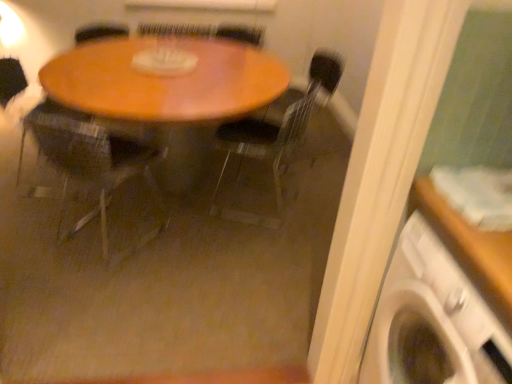
Question: Can you confirm if wooden armchair at center is bigger than wooden table at center?

Choices:
 (A) no
 (B) yes

Answer: (A)

Question: Could you tell me if wooden armchair at center is facing wooden table at center?

Choices:
 (A) yes
 (B) no

Answer: (A)

Question: From the image's perspective, would you say wooden armchair at center is positioned over wooden table at center?

Choices:
 (A) no
 (B) yes

Answer: (A)

Question: Can you confirm if wooden armchair at center is positioned to the right of wooden table at center?

Choices:
 (A) no
 (B) yes

Answer: (A)

Question: Is wooden armchair at center facing away from wooden table at center?

Choices:
 (A) yes
 (B) no

Answer: (B)

Question: Is wooden armchair at center not inside wooden table at center?

Choices:
 (A) no
 (B) yes

Answer: (A)

Question: Is transparent plastic chair at center, the 2th chair from the left, facing towards wooden chair at center, which appears as the first chair when viewed from the left?

Choices:
 (A) yes
 (B) no

Answer: (B)

Question: From the image's perspective, would you say transparent plastic chair at center, which ranks as the first chair in right-to-left order, is shown under wooden chair at center, marked as the second chair in a right-to-left arrangement?

Choices:
 (A) yes
 (B) no

Answer: (B)

Question: Is transparent plastic chair at center, which ranks as the first chair in right-to-left order, positioned far away from wooden chair at center, marked as the second chair in a right-to-left arrangement?

Choices:
 (A) no
 (B) yes

Answer: (A)

Question: From the image's perspective, is transparent plastic chair at center, which ranks as the first chair in right-to-left order, on wooden chair at center, marked as the second chair in a right-to-left arrangement?

Choices:
 (A) no
 (B) yes

Answer: (B)

Question: Is transparent plastic chair at center, the 2th chair from the left, positioned with its back to wooden chair at center, marked as the second chair in a right-to-left arrangement?

Choices:
 (A) no
 (B) yes

Answer: (A)

Question: Is transparent plastic chair at center, which ranks as the first chair in right-to-left order, taller than wooden chair at center, marked as the second chair in a right-to-left arrangement?

Choices:
 (A) no
 (B) yes

Answer: (B)

Question: Considering the relative sizes of white plastic washing machine at lower right and wooden armchair at center in the image provided, is white plastic washing machine at lower right taller than wooden armchair at center?

Choices:
 (A) yes
 (B) no

Answer: (A)